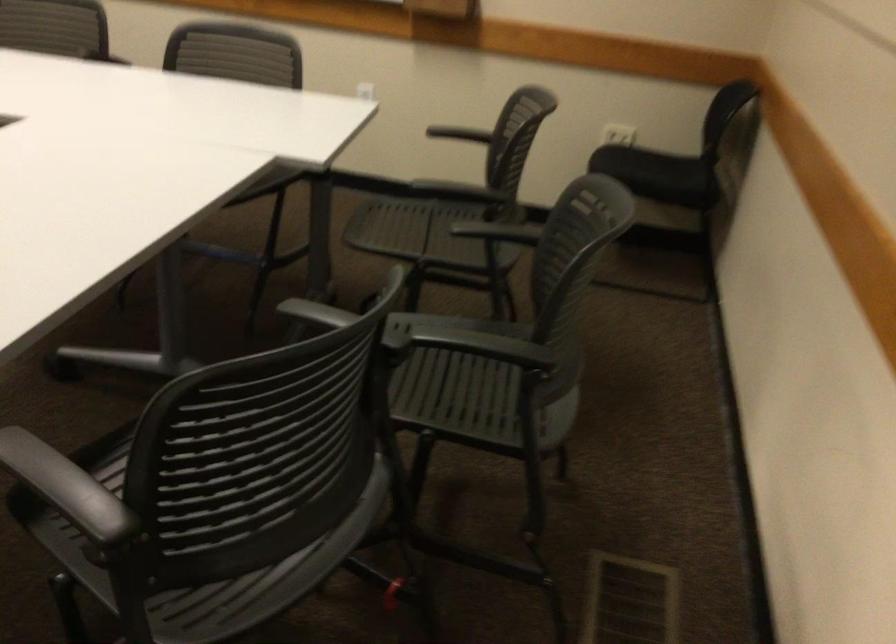
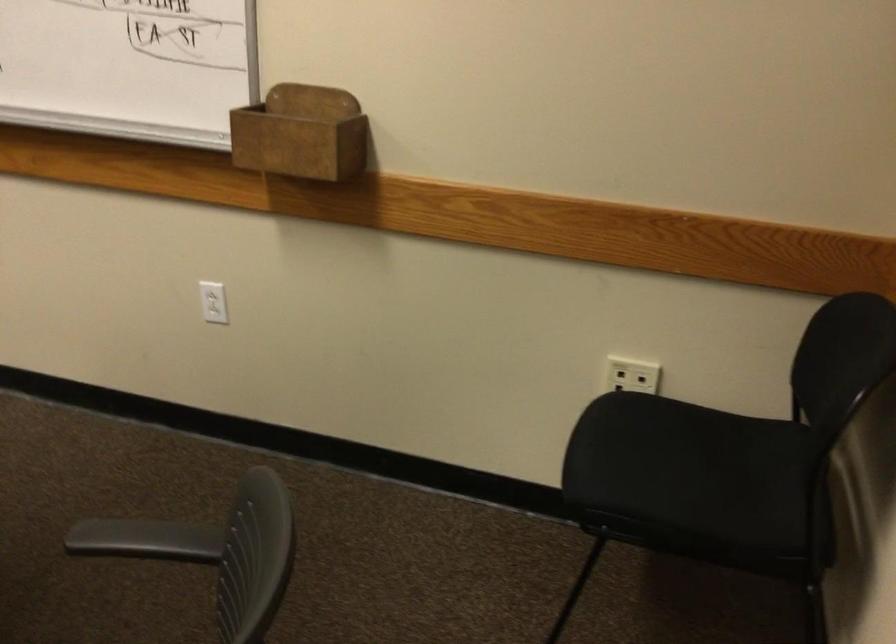
Question: What movement of the cameraman would produce the second image?

Choices:
 (A) Left
 (B) Right
 (C) Forward
 (D) Backward

Answer: (C)